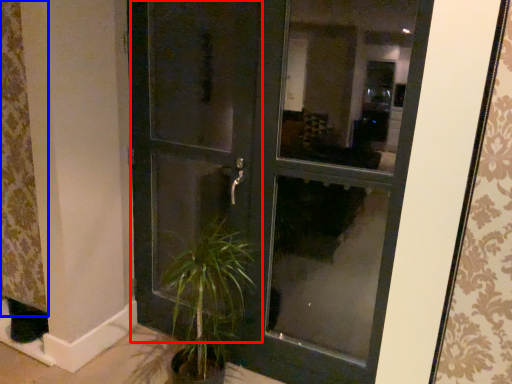
Question: Which point is closer to the camera, screen door (highlighted by a red box) or curtain (highlighted by a blue box)?

Choices:
 (A) screen door
 (B) curtain

Answer: (A)